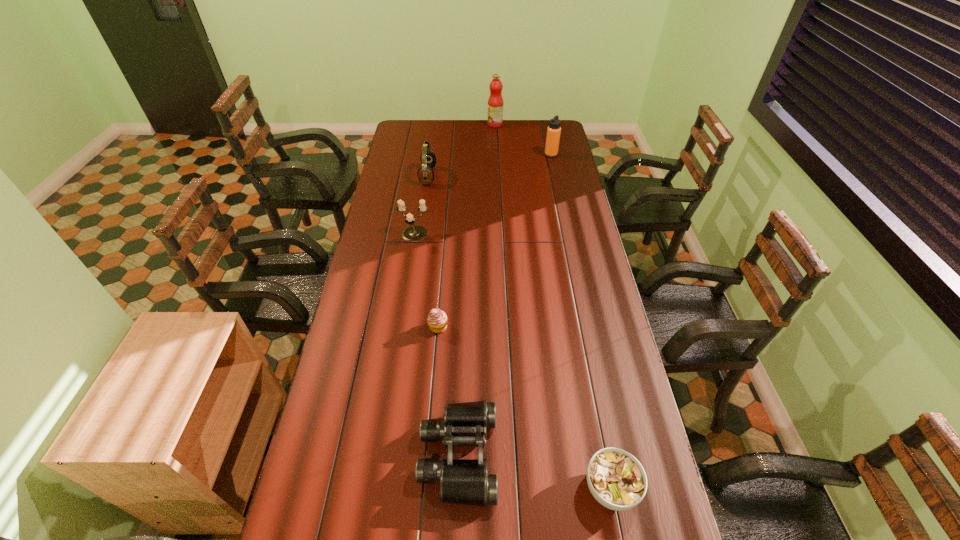
Locate an element on the screen. The height and width of the screenshot is (540, 960). vacant region located 0.390m on the front label of the farthest object is located at coordinates (418, 124).

Identify the location of vacant space located on the front label of the farthest object. (475, 124).

Where is `vacant space situated on the front of the second tallest object`? The height and width of the screenshot is (540, 960). vacant space situated on the front of the second tallest object is located at coordinates coord(562,207).

Image resolution: width=960 pixels, height=540 pixels. What are the coordinates of `blank space located 0.270m on the ear cups of the fifth nearest object` in the screenshot? It's located at (492, 176).

Find the location of a particular element. free region located on the right of the fourth nearest object is located at coordinates (468, 235).

Find the location of `free space located 0.340m on the front-facing side of the third shortest object`. free space located 0.340m on the front-facing side of the third shortest object is located at coordinates (623, 456).

This screenshot has height=540, width=960. Find the location of `free space located on the left of the cupcake`. free space located on the left of the cupcake is located at coordinates (396, 327).

Where is `vacant space positioned 0.250m on the left of the soup bowl`? vacant space positioned 0.250m on the left of the soup bowl is located at coordinates (485, 488).

This screenshot has width=960, height=540. Find the location of `object located at the far edge`. object located at the far edge is located at coordinates (495, 102).

This screenshot has height=540, width=960. Identify the location of object that is at the left edge. (414, 233).